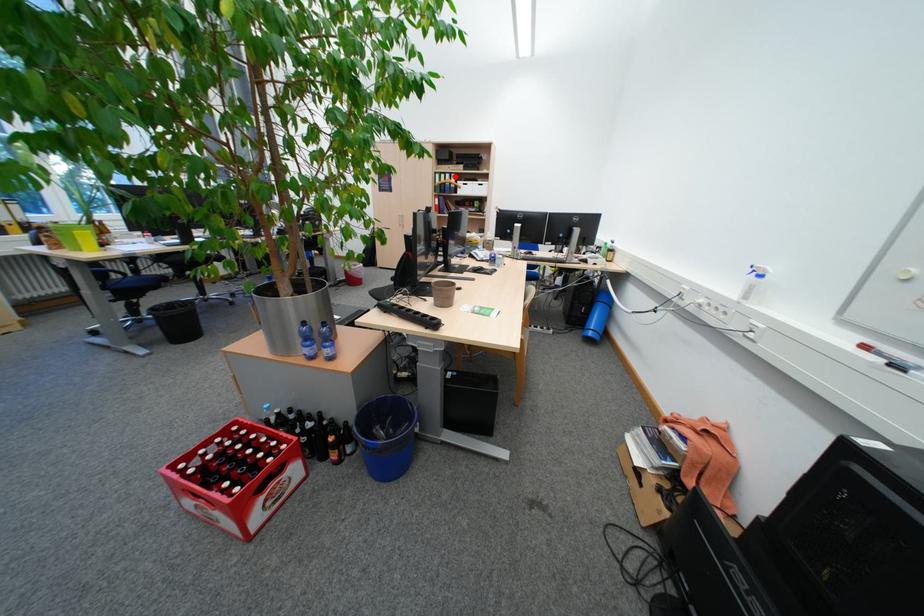
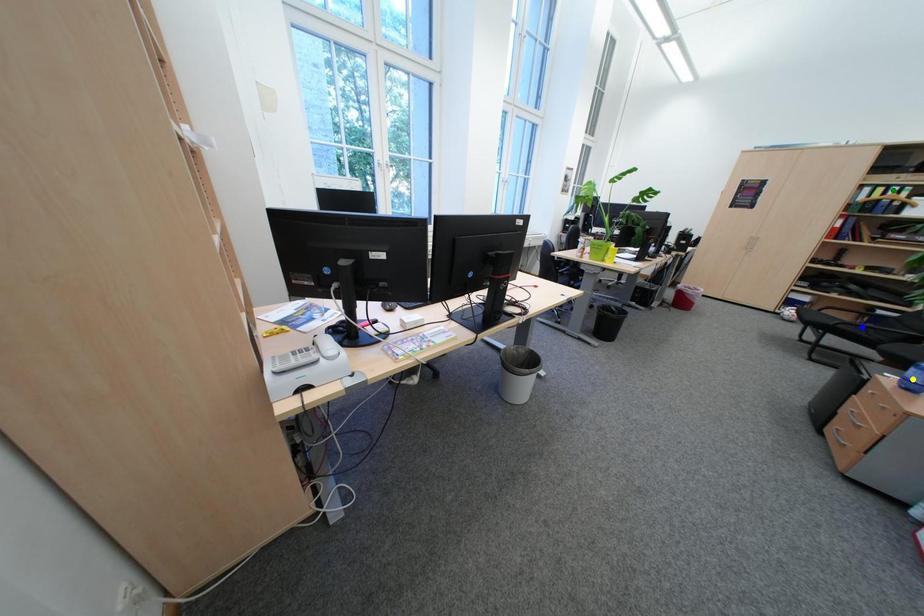
Question: I am providing you with two images of the same scene from different viewpoints. A red point is marked on the first image. You are given multiple points on the second image. Which point in image 2 represents the same 3d spot as the red point in image 1?

Choices:
 (A) green point
 (B) yellow point
 (C) blue point

Answer: (A)